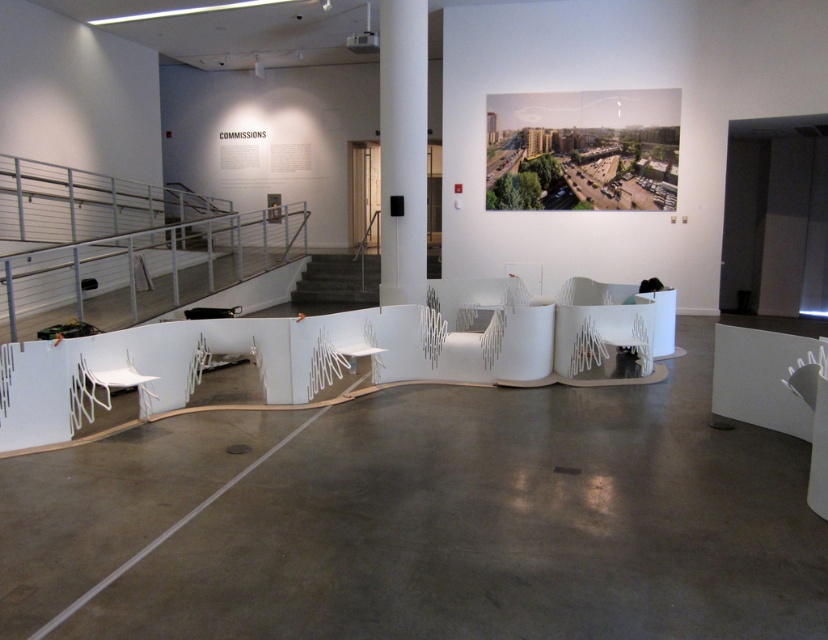
From the picture: Between white plastic chair at center and white matte chair at lower center, which one appears on the left side from the viewer's perspective?

Positioned to the left is white matte chair at lower center.

Can you confirm if white plastic chair at center is taller than white matte chair at lower center?

Yes, white plastic chair at center is taller than white matte chair at lower center.

Image resolution: width=828 pixels, height=640 pixels. What do you see at coordinates (627, 339) in the screenshot?
I see `white plastic chair at center` at bounding box center [627, 339].

Find the location of a particular element. The width and height of the screenshot is (828, 640). white plastic chair at center is located at coordinates (627, 339).

Is white matte column at center closer to the viewer compared to white matte chair at center?

Yes, it is.

Which is behind, point (400, 83) or point (533, 269)?

The point (533, 269) is behind.

Between point (426, 182) and point (540, 300), which one is positioned behind?

Point (540, 300)

Image resolution: width=828 pixels, height=640 pixels. What are the coordinates of `white matte column at center` in the screenshot? It's located at (403, 150).

Does dark gray concrete stairs at center have a smaller size compared to white matte chair at lower left?

Incorrect, dark gray concrete stairs at center is not smaller in size than white matte chair at lower left.

Does dark gray concrete stairs at center appear on the right side of white matte chair at lower left?

Correct, you'll find dark gray concrete stairs at center to the right of white matte chair at lower left.

Does point (359, 257) lie in front of point (116, 369)?

No, (359, 257) is behind (116, 369).

Locate an element on the screen. This screenshot has height=640, width=828. dark gray concrete stairs at center is located at coordinates point(335,284).